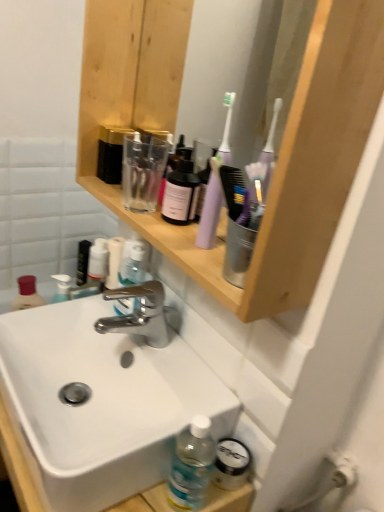
The image size is (384, 512). Find the location of `vacant space in front of polished chrome faucet at center`. vacant space in front of polished chrome faucet at center is located at coordinates (156, 389).